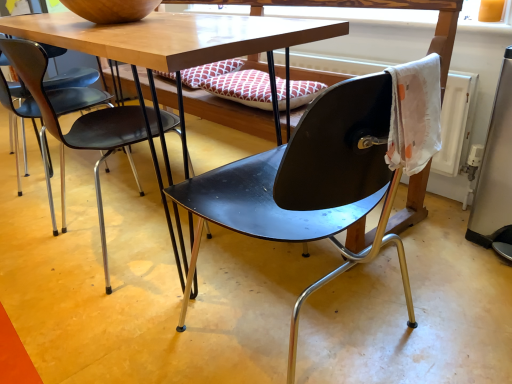
Identify the location of vacant space that is to the left of matte black chair at center, the 2th chair in the right-to-left sequence. The height and width of the screenshot is (384, 512). (42, 236).